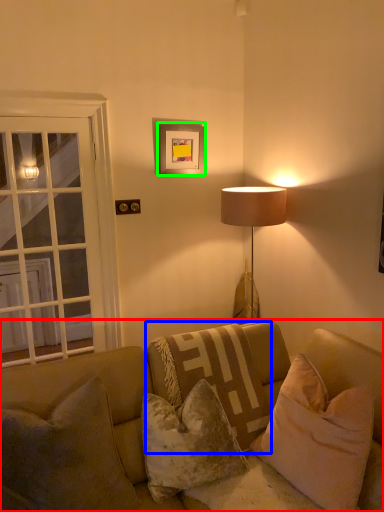
Question: Which object is the farthest from studio couch (highlighted by a red box)? Choose among these: pillow (highlighted by a blue box) or picture frame (highlighted by a green box).

Choices:
 (A) pillow
 (B) picture frame

Answer: (B)